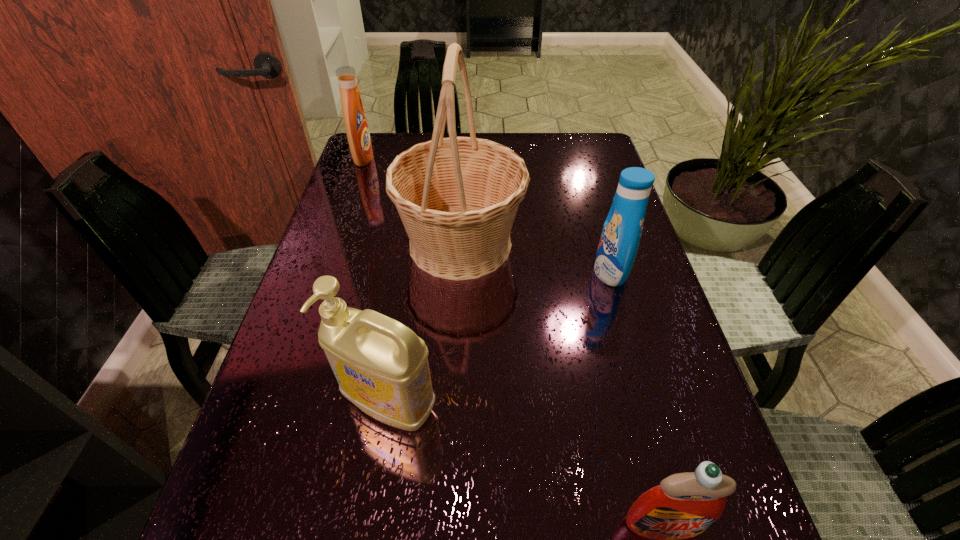
What are the coordinates of `basket` in the screenshot? It's located at (457, 197).

Locate an element on the screen. This screenshot has width=960, height=540. the second nearest detergent is located at coordinates (381, 365).

At what (x,y) coordinates should I click in order to perform the action: click on the fourth farthest object. Please return your answer as a coordinate pair (x, y). The image size is (960, 540). Looking at the image, I should click on (381, 365).

Identify the location of the farthest detergent. The image size is (960, 540). (355, 120).

Image resolution: width=960 pixels, height=540 pixels. Find the location of `the leftmost detergent`. the leftmost detergent is located at coordinates (355, 120).

Identify the location of the second farthest detergent. (622, 230).

At what (x,y) coordinates should I click in order to perform the action: click on vacant area situated on the left of the tallest object. Please return your answer as a coordinate pair (x, y). Looking at the image, I should click on (348, 244).

This screenshot has height=540, width=960. I want to click on blank area located on the back of the second nearest detergent, so click(x=414, y=248).

At what (x,y) coordinates should I click in order to perform the action: click on vacant region located on the front-facing side of the leftmost detergent. Please return your answer as a coordinate pair (x, y). Image resolution: width=960 pixels, height=540 pixels. Looking at the image, I should click on (431, 158).

The height and width of the screenshot is (540, 960). In order to click on vacant space located 0.340m on the front-facing side of the second farthest detergent in this screenshot , I will do `click(447, 272)`.